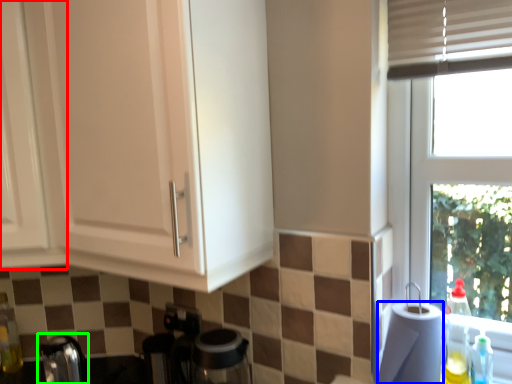
Question: Which object is the farthest from cabinetry (highlighted by a red box)? Choose among these: paper towel (highlighted by a blue box) or faucet (highlighted by a green box).

Choices:
 (A) paper towel
 (B) faucet

Answer: (A)